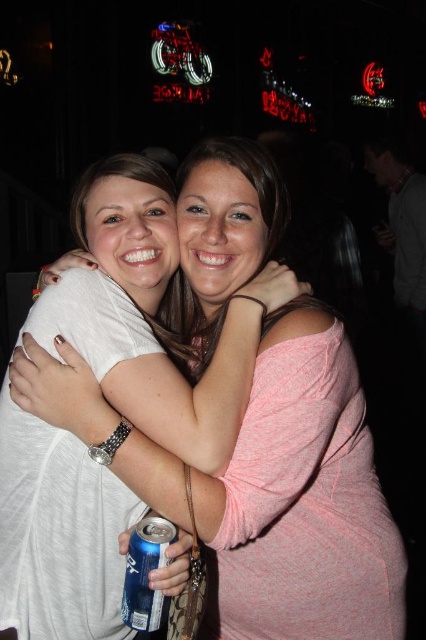
Which is below, pink fabric shirt at center or blue metallic can at lower center?

blue metallic can at lower center is lower down.

Who is more distant from viewer, [281,369] or [137,579]?

The point [281,369] is more distant.

I want to click on pink fabric shirt at center, so click(x=302, y=499).